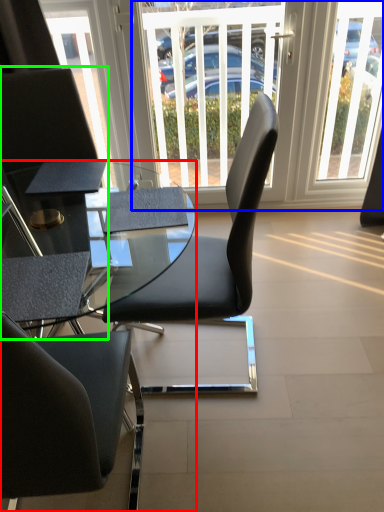
Question: Estimate the real-world distances between objects in this image. Which object is closer to desk (highlighted by a red box), window screen (highlighted by a blue box) or chair (highlighted by a green box)?

Choices:
 (A) window screen
 (B) chair

Answer: (B)